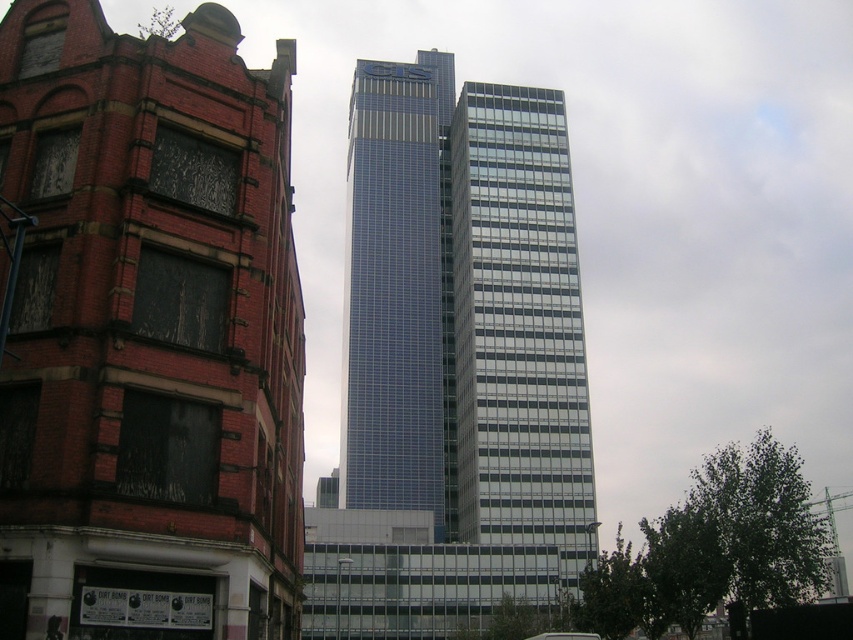
You are an architect analyzing the two blue buildings in the image. The scene shows a red brick building on the left and a modern skyscraper on the right. You need to determine which of the blue glassy tower at center or the blue glass skyscraper at center is bigger in size. Based on the scene, which one is larger?

The blue glassy tower at center is larger in size compared to the blue glass skyscraper at center according to the description.

You are standing in the middle of the street between the two buildings. You want to take a photo of the blue glassy tower at center and the blue glass skyscraper at center. Which one will appear larger in the photo?

The blue glassy tower at center will appear larger in the photo because it is closer to the viewer than the blue glass skyscraper at center.

You are an architect analyzing the two blue glass structures in the image. Which one is taller between the blue glassy tower at center and the blue glass skyscraper at center?

The blue glassy tower at center is taller than the blue glass skyscraper at center according to the description.